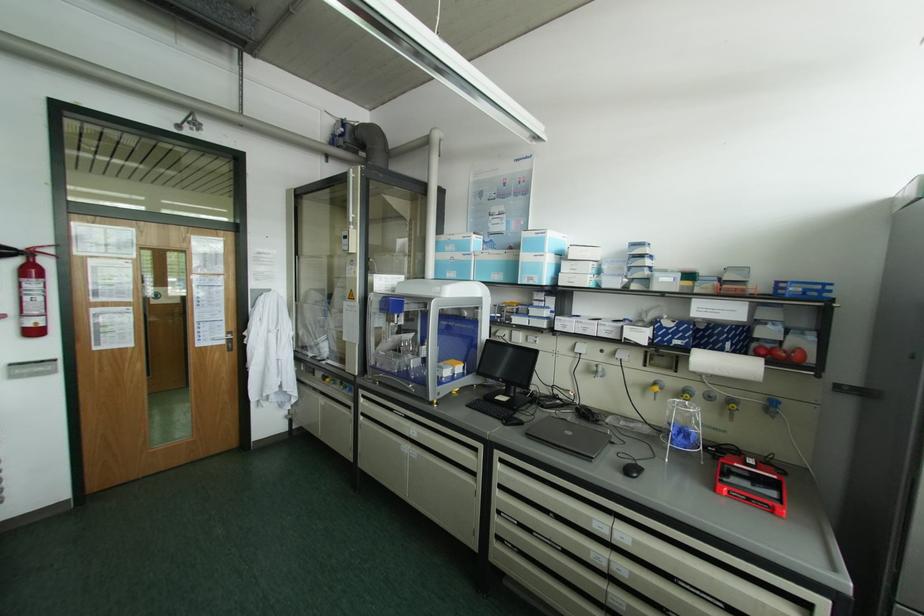
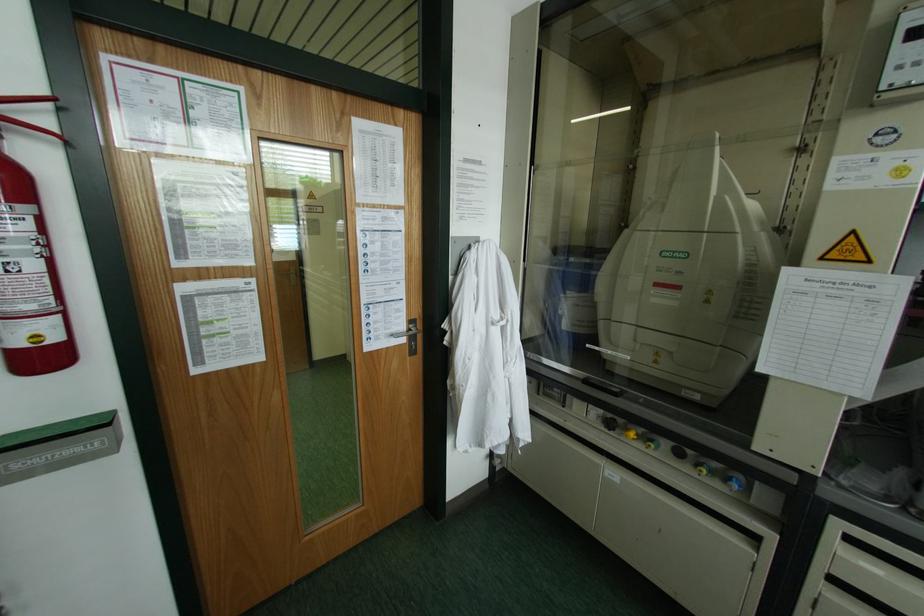
In the second image, find the point that corresponds to [227,331] in the first image.

(409, 321)